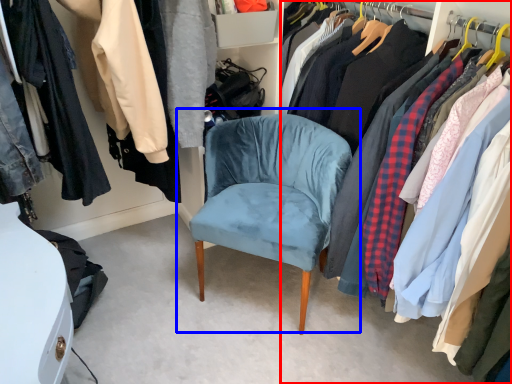
Question: Which object is closer to the camera taking this photo, closet (highlighted by a red box) or chair (highlighted by a blue box)?

Choices:
 (A) closet
 (B) chair

Answer: (A)